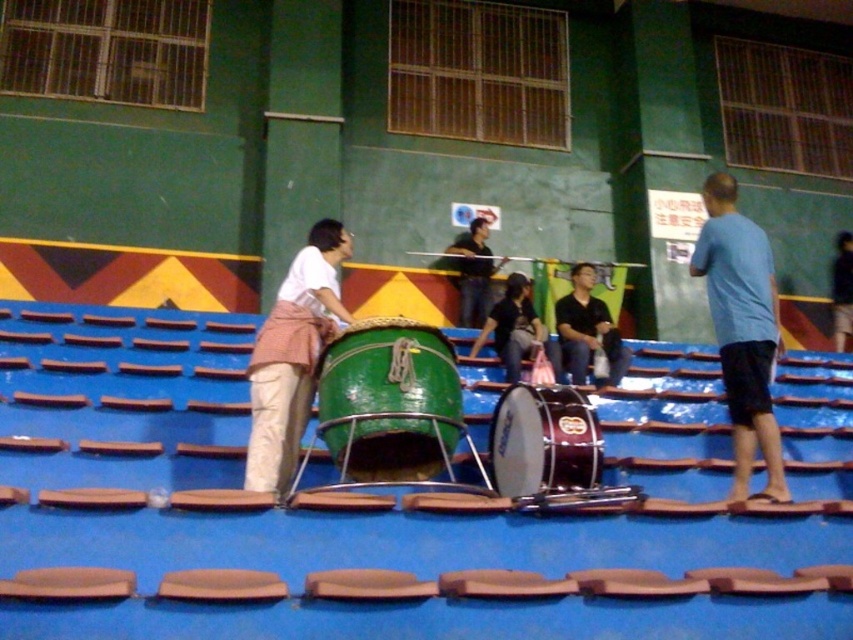
Does shiny brown drum at center have a lesser height compared to black fabric shirt at center?

Indeed, shiny brown drum at center has a lesser height compared to black fabric shirt at center.

Can you confirm if shiny brown drum at center is bigger than black fabric shirt at center?

Actually, shiny brown drum at center might be smaller than black fabric shirt at center.

Is point (502, 396) closer to viewer compared to point (506, 346)?

Yes, it is.

You are a GUI agent. You are given a task and a screenshot of the screen. Output one action in this format:
    pyautogui.click(x=<x>, y=<y>)
    Task: Click on the shiny brown drum at center
    
    Given the screenshot: What is the action you would take?
    pyautogui.click(x=543, y=440)

Which is more to the right, matte pink skirt at center or shiny brown drum at center?

From the viewer's perspective, shiny brown drum at center appears more on the right side.

Measure the distance between matte pink skirt at center and camera.

matte pink skirt at center and camera are 5.66 meters apart from each other.

This screenshot has height=640, width=853. I want to click on matte pink skirt at center, so click(x=293, y=355).

Can you confirm if green wooden drum at center is positioned below matte black shirt at center?

Yes.

Does green wooden drum at center appear on the right side of matte black shirt at center?

No, green wooden drum at center is not to the right of matte black shirt at center.

Is point (374, 394) positioned in front of point (467, 264)?

That is True.

Image resolution: width=853 pixels, height=640 pixels. In order to click on green wooden drum at center in this screenshot , I will do `click(389, 401)`.